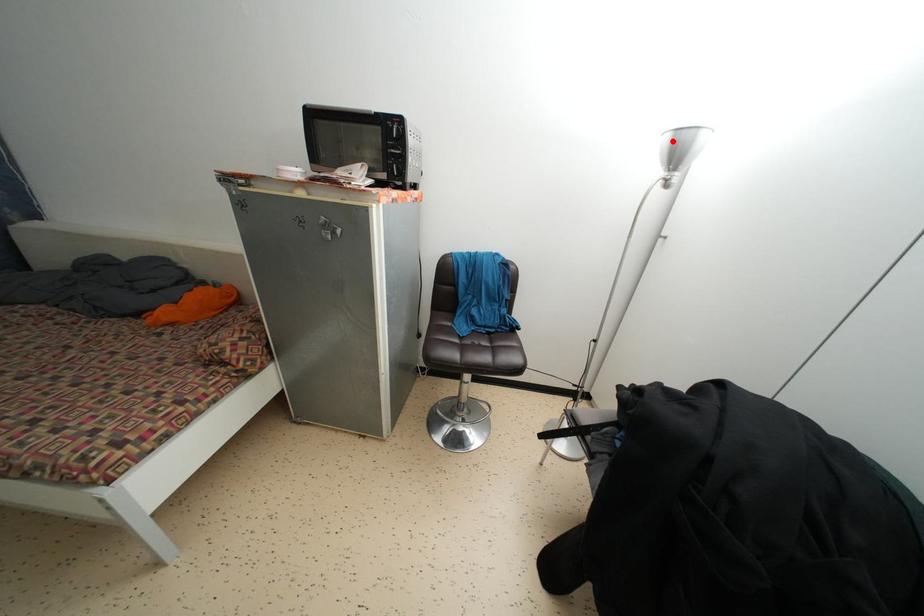
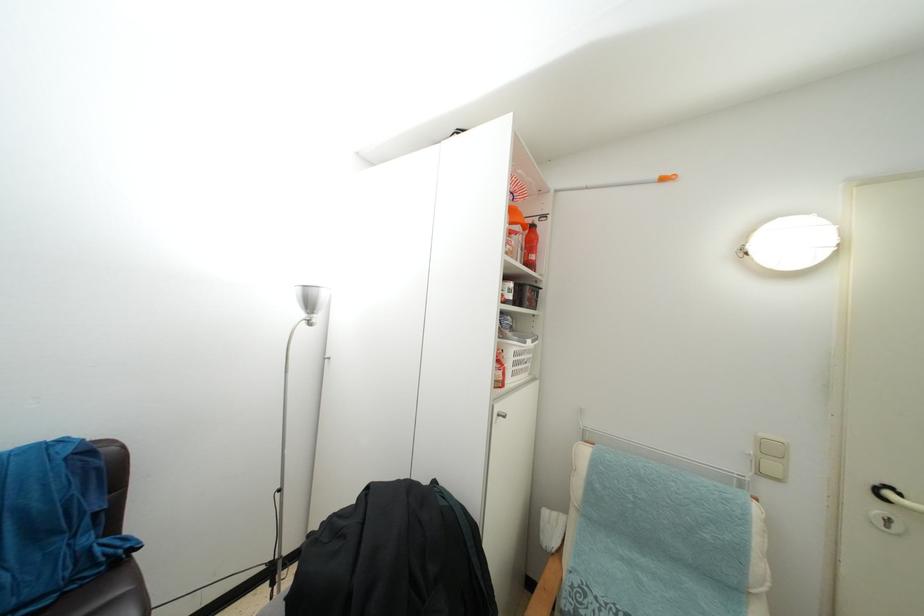
Where in the second image is the point corresponding to the highlighted location from the first image?

(304, 294)